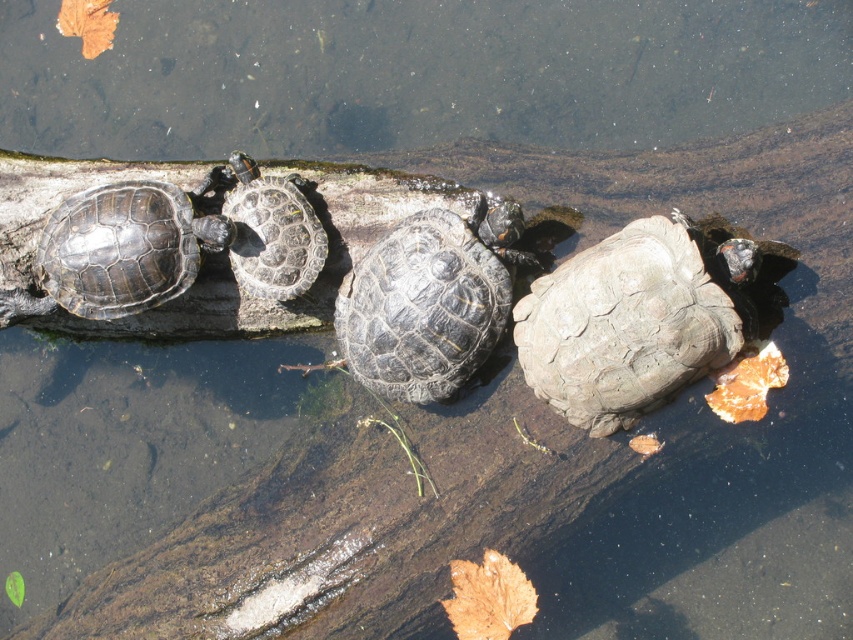
You are a wildlife photographer aiming to capture a closeup of the shiny dark gray tortoise at left and the dark gray textured shell at center. Since you want to focus on both, which turtle should you get closer to?

The dark gray textured shell at center is much taller as shiny dark gray tortoise at left, so you should get closer to the shiny dark gray tortoise at left to ensure both are in focus.

You are a wildlife photographer trying to capture a closeup of the shiny dark gray tortoise at left and the gray textured shell at center. Since your camera has a limited focus range, you need to know which turtle is closer to the front. Which turtle is positioned closer to the front of the log?

The shiny dark gray tortoise at left is positioned closer to the front of the log than the gray textured shell at center because the gray textured shell at center has a larger size, indicating it might be further back where it appears bigger due to perspective.

You are a wildlife photographer aiming to capture a closeup of the shiny dark gray tortoise at left and the gray textured shell at center. Based on their positions, which turtle is lower in the image?

The gray textured shell at center is below the shiny dark gray tortoise at left, so the gray textured shell at center is lower in the image.